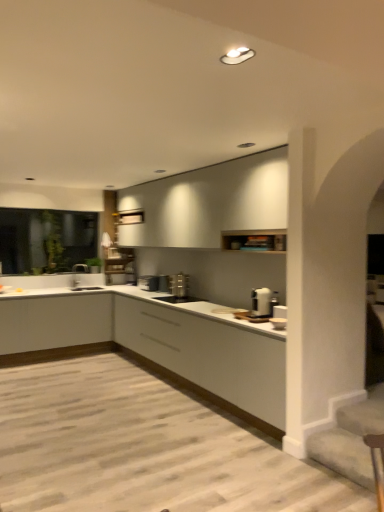
Identify the location of black matte sink at center, the second appliance when ordered from left to right. This screenshot has height=512, width=384. [x=177, y=298].

You are a GUI agent. You are given a task and a screenshot of the screen. Output one action in this format:
    pyautogui.click(x=<x>, y=<y>)
    Task: Click on the silver metallic tap at center
    The width and height of the screenshot is (384, 512).
    Given the screenshot: What is the action you would take?
    pyautogui.click(x=78, y=273)

Based on the photo, measure the distance between white glossy toaster at center, the first appliance viewed from the right, and camera.

They are 3.96 meters apart.

Identify the location of white glossy toaster at center, the first appliance in the front-to-back sequence. (261, 302).

Image resolution: width=384 pixels, height=512 pixels. Find the location of `white matte cabinet at center, positioned as the third cabinetry in top-to-bottom order`. white matte cabinet at center, positioned as the third cabinetry in top-to-bottom order is located at coordinates (208, 355).

In terms of size, does silver metallic tap at center appear bigger or smaller than transparent glass door at left?

silver metallic tap at center is smaller than transparent glass door at left.

Is silver metallic tap at center behind transparent glass door at left?

Yes, the depth of silver metallic tap at center is greater than that of transparent glass door at left.

In terms of width, does silver metallic tap at center look wider or thinner when compared to transparent glass door at left?

Clearly, silver metallic tap at center has more width compared to transparent glass door at left.

Can you tell me how much silver metallic tap at center and transparent glass door at left differ in facing direction?

45.7 degrees separate the facing orientations of silver metallic tap at center and transparent glass door at left.

Is point (154, 290) positioned in front of point (35, 261)?

Yes, point (154, 290) is closer to viewer.

Is satin silver toaster at center, the fourth appliance viewed from the front, wider than transparent glass door at left?

Yes.

From a real-world perspective, count 3rd appliances downward from the transparent glass door at left and point to it. Please provide its 2D coordinates.

[(149, 282)]

From the image's perspective, is white matte cabinet at upper center, the 3th cabinetry in the bottom-to-top sequence, above or below black matte sink at center, marked as the 2th appliance in a front-to-back arrangement?

white matte cabinet at upper center, the 3th cabinetry in the bottom-to-top sequence, is situated higher than black matte sink at center, marked as the 2th appliance in a front-to-back arrangement, in the image.

Which object is wider, white matte cabinet at upper center, the 3th cabinetry in the bottom-to-top sequence, or black matte sink at center, the second appliance when ordered from left to right?

black matte sink at center, the second appliance when ordered from left to right.

Where is `the 1st cabinetry in front of the black matte sink at center, positioned as the third appliance in right-to-left order`? The width and height of the screenshot is (384, 512). the 1st cabinetry in front of the black matte sink at center, positioned as the third appliance in right-to-left order is located at coordinates (208, 203).

Does white matte cabinet at lower left, the 2th cabinetry from the bottom, turn towards satin silver toaster at center, acting as the 2th appliance starting from the back?

Yes, white matte cabinet at lower left, the 2th cabinetry from the bottom, is facing satin silver toaster at center, acting as the 2th appliance starting from the back.

From the picture: Is white matte cabinet at lower left, arranged as the second cabinetry when viewed from the top, taller than satin silver toaster at center, which is counted as the 3th appliance, starting from the front?

Correct, white matte cabinet at lower left, arranged as the second cabinetry when viewed from the top, is much taller as satin silver toaster at center, which is counted as the 3th appliance, starting from the front.

Is white matte cabinet at lower left, arranged as the second cabinetry when viewed from the top, at the left side of satin silver toaster at center, which is counted as the 3th appliance, starting from the front?

Yes, white matte cabinet at lower left, arranged as the second cabinetry when viewed from the top, is to the left of satin silver toaster at center, which is counted as the 3th appliance, starting from the front.

Which is behind, point (24, 351) or point (183, 284)?

Point (24, 351)

How far apart are transparent glass door at left and satin silver toaster at center, which is counted as the 3th appliance, starting from the front?

The distance of transparent glass door at left from satin silver toaster at center, which is counted as the 3th appliance, starting from the front, is 5.02 meters.

Which is more to the left, transparent glass door at left or satin silver toaster at center, marked as the second appliance in a right-to-left arrangement?

transparent glass door at left is more to the left.

What's the angular difference between transparent glass door at left and satin silver toaster at center, acting as the 2th appliance starting from the back,'s facing directions?

The angle between the facing direction of transparent glass door at left and the facing direction of satin silver toaster at center, acting as the 2th appliance starting from the back, is 90.6 degrees.

From a real-world perspective, which object stands above the other?

From a 3D spatial view, transparent glass door at left is above.

Considering the positions of objects satin silver toaster at center, which is counted as the 3th appliance, starting from the front, and white matte cabinet at lower left, arranged as the second cabinetry when viewed from the top, in the image provided, who is in front, satin silver toaster at center, which is counted as the 3th appliance, starting from the front, or white matte cabinet at lower left, arranged as the second cabinetry when viewed from the top,?

satin silver toaster at center, which is counted as the 3th appliance, starting from the front, is closer to the camera.

Considering the sizes of objects satin silver toaster at center, acting as the 2th appliance starting from the back, and white matte cabinet at lower left, the 2th cabinetry from the bottom, in the image provided, who is smaller, satin silver toaster at center, acting as the 2th appliance starting from the back, or white matte cabinet at lower left, the 2th cabinetry from the bottom,?

satin silver toaster at center, acting as the 2th appliance starting from the back, is smaller.

Is satin silver toaster at center, which is the third appliance from left to right, facing towards white matte cabinet at lower left, the 2th cabinetry from the bottom?

No, satin silver toaster at center, which is the third appliance from left to right, is not turned towards white matte cabinet at lower left, the 2th cabinetry from the bottom.

Is satin silver toaster at center, which is the third appliance from left to right, aimed at black matte sink at center, marked as the 2th appliance in a front-to-back arrangement?

No, satin silver toaster at center, which is the third appliance from left to right, is not facing towards black matte sink at center, marked as the 2th appliance in a front-to-back arrangement.

Which of these two, satin silver toaster at center, which is the third appliance from left to right, or black matte sink at center, marked as the 2th appliance in a front-to-back arrangement, is smaller?

black matte sink at center, marked as the 2th appliance in a front-to-back arrangement.

Which object is more forward, satin silver toaster at center, which is the third appliance from left to right, or black matte sink at center, the second appliance when ordered from left to right?

black matte sink at center, the second appliance when ordered from left to right.

In the image, is satin silver toaster at center, which is counted as the 3th appliance, starting from the front, on the left side or the right side of black matte sink at center, positioned as the third appliance in right-to-left order?

Based on their positions, satin silver toaster at center, which is counted as the 3th appliance, starting from the front, is located to the right of black matte sink at center, positioned as the third appliance in right-to-left order.

The width and height of the screenshot is (384, 512). I want to click on tap behind the transparent glass door at left, so click(x=78, y=273).

From the transparent glass door at left, count 1st appliance to the right and point to it. Please provide its 2D coordinates.

[(149, 282)]

From the image, which object appears to be farther from satin silver toaster at center, acting as the 2th appliance starting from the back, transparent glass door at left or white matte cabinet at center, positioned as the third cabinetry in top-to-bottom order?

Based on the image, transparent glass door at left appears to be further to satin silver toaster at center, acting as the 2th appliance starting from the back.

Considering their positions, is white glossy toaster at center, the first appliance in the front-to-back sequence, positioned further to black matte sink at center, which is the third appliance from back to front, than white matte cabinet at upper center, the 3th cabinetry in the bottom-to-top sequence?

white glossy toaster at center, the first appliance in the front-to-back sequence, is further to black matte sink at center, which is the third appliance from back to front.

Considering their positions, is satin silver toaster at center, which is the third appliance from left to right, positioned further to white matte cabinet at center, the 1th cabinetry when ordered from bottom to top, than satin silver toaster at center, which is the first appliance in left-to-right order?

satin silver toaster at center, which is the first appliance in left-to-right order.

Estimate the real-world distances between objects in this image. Which object is further from satin silver toaster at center, which is counted as the 3th appliance, starting from the front, white glossy toaster at center, which is the fourth appliance from left to right, or satin silver toaster at center, which is the first appliance in left-to-right order?

white glossy toaster at center, which is the fourth appliance from left to right, lies further to satin silver toaster at center, which is counted as the 3th appliance, starting from the front, than the other object.

When comparing their distances from silver metallic tap at center, does white matte cabinet at upper center, the 3th cabinetry in the bottom-to-top sequence, or satin silver toaster at center, marked as the second appliance in a right-to-left arrangement, seem closer?

satin silver toaster at center, marked as the second appliance in a right-to-left arrangement.

When comparing their distances from satin silver toaster at center, marked as the second appliance in a right-to-left arrangement, does white matte cabinet at lower left, the 2th cabinetry from the bottom, or satin silver toaster at center, which is the first appliance in left-to-right order, seem closer?

Based on the image, satin silver toaster at center, which is the first appliance in left-to-right order, appears to be nearer to satin silver toaster at center, marked as the second appliance in a right-to-left arrangement.

Considering their positions, is black matte sink at center, marked as the 2th appliance in a front-to-back arrangement, positioned closer to white matte cabinet at lower left, the 2th cabinetry from the bottom, than transparent glass door at left?

The object closer to white matte cabinet at lower left, the 2th cabinetry from the bottom, is black matte sink at center, marked as the 2th appliance in a front-to-back arrangement.

Based on their spatial positions, is white matte cabinet at center, positioned as the third cabinetry in top-to-bottom order, or silver metallic tap at center closer to black matte sink at center, marked as the 2th appliance in a front-to-back arrangement?

The object closer to black matte sink at center, marked as the 2th appliance in a front-to-back arrangement, is white matte cabinet at center, positioned as the third cabinetry in top-to-bottom order.

Locate an element on the screen. Image resolution: width=384 pixels, height=512 pixels. cabinetry between white matte cabinet at upper center, the 3th cabinetry in the bottom-to-top sequence, and transparent glass door at left from front to back is located at coordinates (54, 322).

At what (x,y) coordinates should I click in order to perform the action: click on tap between white matte cabinet at lower left, arranged as the second cabinetry when viewed from the top, and white glossy toaster at center, the 4th appliance from the back, in the horizontal direction. Please return your answer as a coordinate pair (x, y). Image resolution: width=384 pixels, height=512 pixels. Looking at the image, I should click on (78, 273).

This screenshot has height=512, width=384. I want to click on glass door between white matte cabinet at center, the 1th cabinetry when ordered from bottom to top, and silver metallic tap at center, along the z-axis, so click(46, 240).

Where is `appliance located between black matte sink at center, which is the third appliance from back to front, and satin silver toaster at center, the fourth appliance viewed from the front, in the depth direction`? The image size is (384, 512). appliance located between black matte sink at center, which is the third appliance from back to front, and satin silver toaster at center, the fourth appliance viewed from the front, in the depth direction is located at coordinates (179, 285).